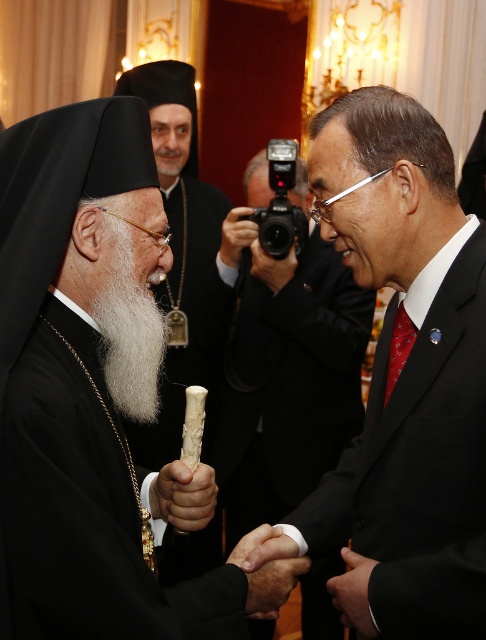
Question: Does smooth black suit at center have a larger size compared to white fluffy beard at center?

Choices:
 (A) yes
 (B) no

Answer: (A)

Question: In this image, where is smooth black suit at center located relative to white fluffy beard at center?

Choices:
 (A) left
 (B) right

Answer: (B)

Question: Where is smooth black suit at center located in relation to white fluffy beard at center in the image?

Choices:
 (A) left
 (B) right

Answer: (B)

Question: Which point is closer to the camera?

Choices:
 (A) (134, 387)
 (B) (408, 602)

Answer: (B)